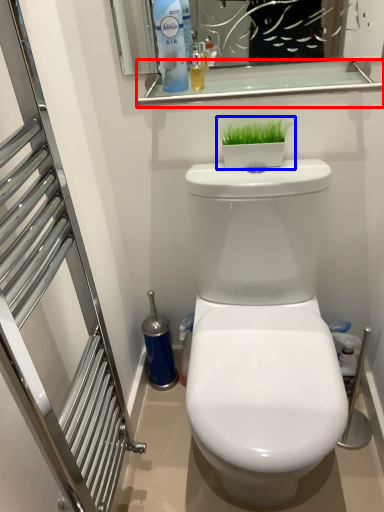
Question: Which object is closer to the camera taking this photo, balustrade (highlighted by a red box) or houseplant (highlighted by a blue box)?

Choices:
 (A) balustrade
 (B) houseplant

Answer: (A)